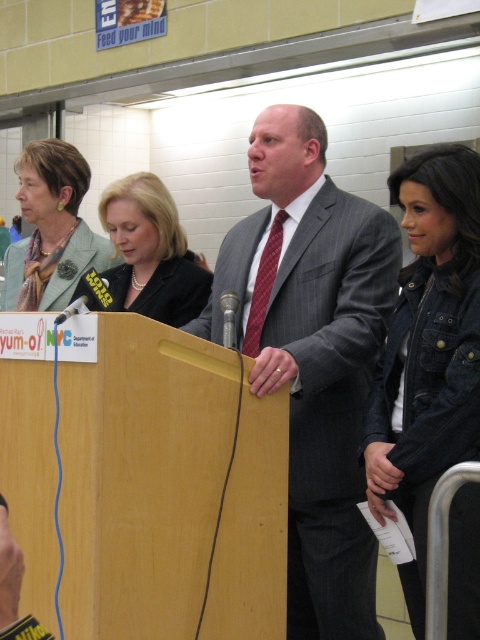
Question: Can you confirm if denim jacket at lower right is positioned above metallic silver microphone at center?

Choices:
 (A) no
 (B) yes

Answer: (A)

Question: Among these points, which one is farthest from the camera?

Choices:
 (A) (121, 304)
 (B) (468, 364)
 (C) (301, 307)

Answer: (A)

Question: Which of the following is the closest to the observer?

Choices:
 (A) (267, 173)
 (B) (228, 321)
 (C) (35, 172)
 (D) (194, 294)

Answer: (B)

Question: Can you confirm if gray pinstripe suit at center is wider than matte green blazer at upper left?

Choices:
 (A) yes
 (B) no

Answer: (A)

Question: Does gray pinstripe suit at center appear under denim jacket at lower right?

Choices:
 (A) no
 (B) yes

Answer: (A)

Question: Which point is farther to the camera?

Choices:
 (A) pyautogui.click(x=225, y=339)
 (B) pyautogui.click(x=424, y=179)
 (C) pyautogui.click(x=189, y=308)

Answer: (C)